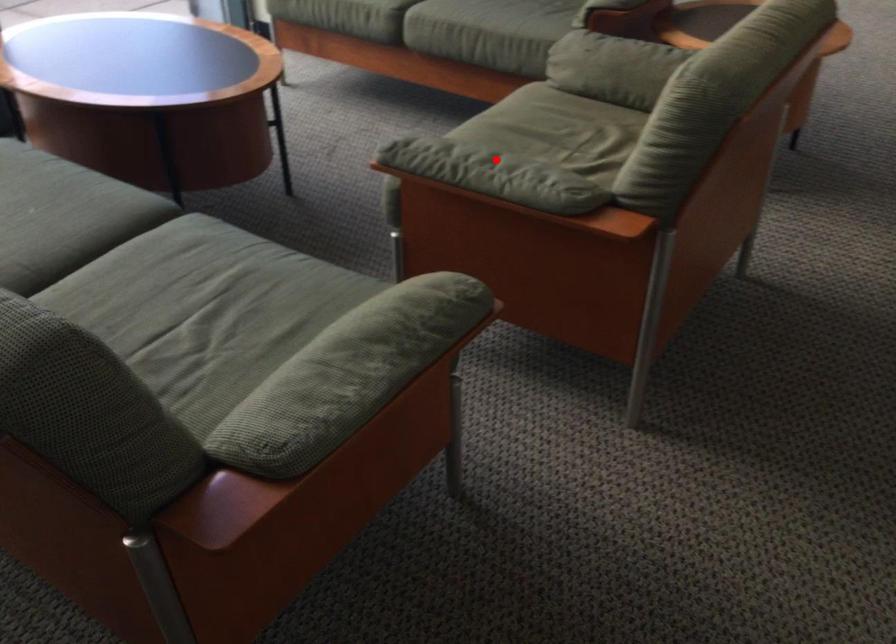
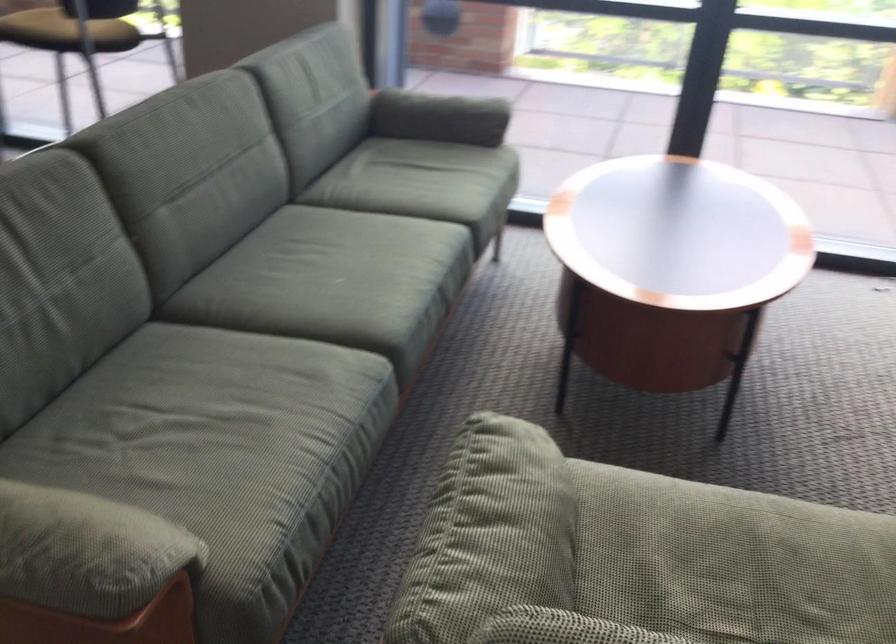
Find the pixel in the second image that matches the highlighted location in the first image.

(500, 527)